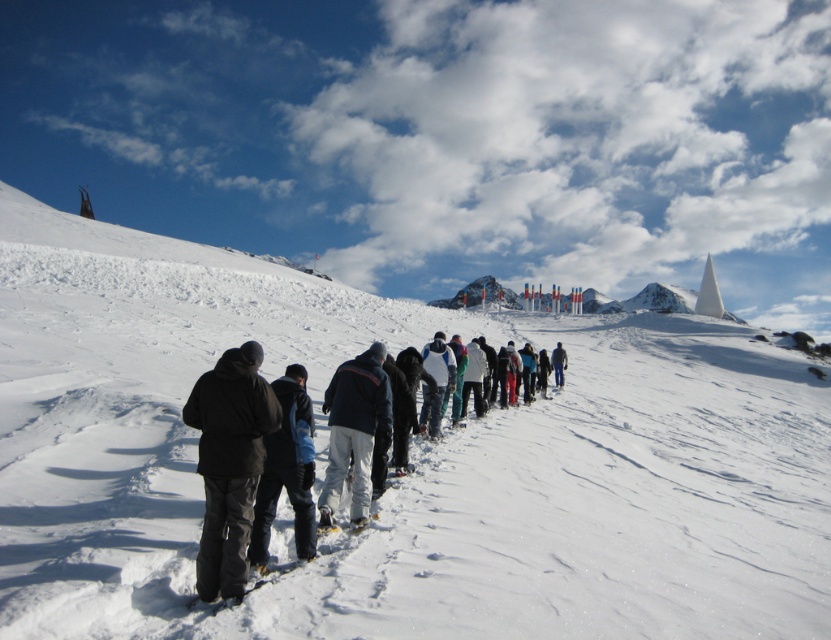
You are a photographer trying to capture the group in the snowy landscape. You notice two pairs of pants at the center of the image. Which pair of pants is taller, the dark gray pants at center or the white matte snow pants at center?

The dark gray pants at center has a greater height compared to the white matte snow pants at center, so the dark gray pants at center is taller.

You are a photographer trying to capture the group of people walking in the snowy landscape. You notice the black matte jacket at lower left and the white matte snow pants at center. Which clothing item appears narrower in the photo?

The black matte jacket at lower left appears narrower because its width is less than the white matte snow pants at center.

You are a photographer trying to capture the group of people walking in the snowy landscape. You want to focus on the dark gray pants at center. Where exactly should you point your camera to ensure the pants are in the frame?

You should point your camera to the coordinates point at point at point at point at point at point at point at point at point at point at point at point at point at point at point at point at point at point at point at point at point at point at point at point at point at point at point at point at point at point at point at point at point at point at point at point at point at point at point at point at point at point at point at point at point at point at point at point at point at point at point at point